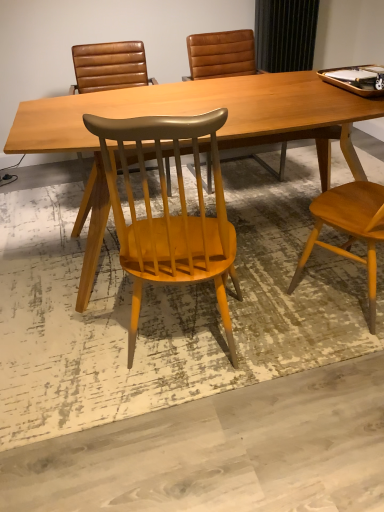
This screenshot has height=512, width=384. In order to click on empty space that is ontop of light brown wood desk at center in this screenshot , I will do `click(274, 95)`.